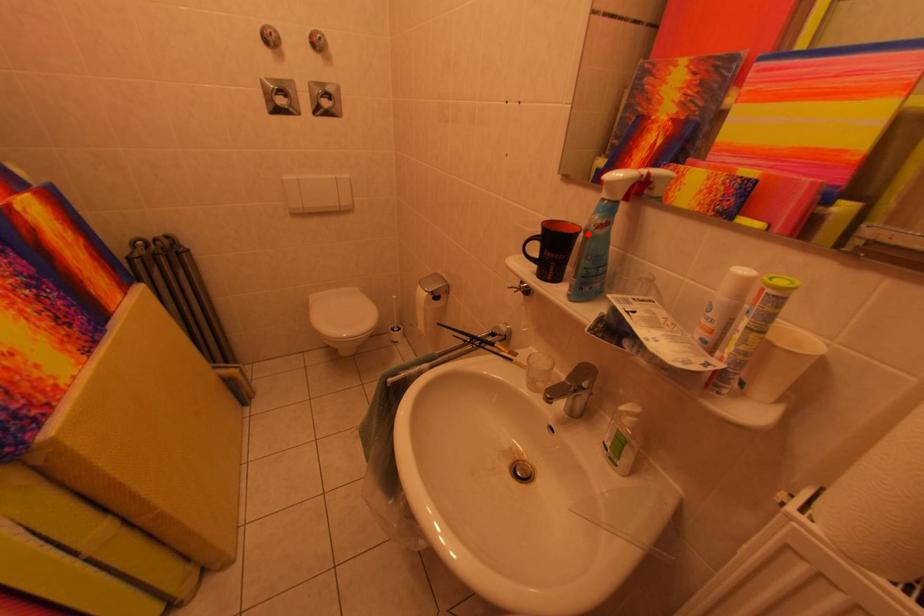
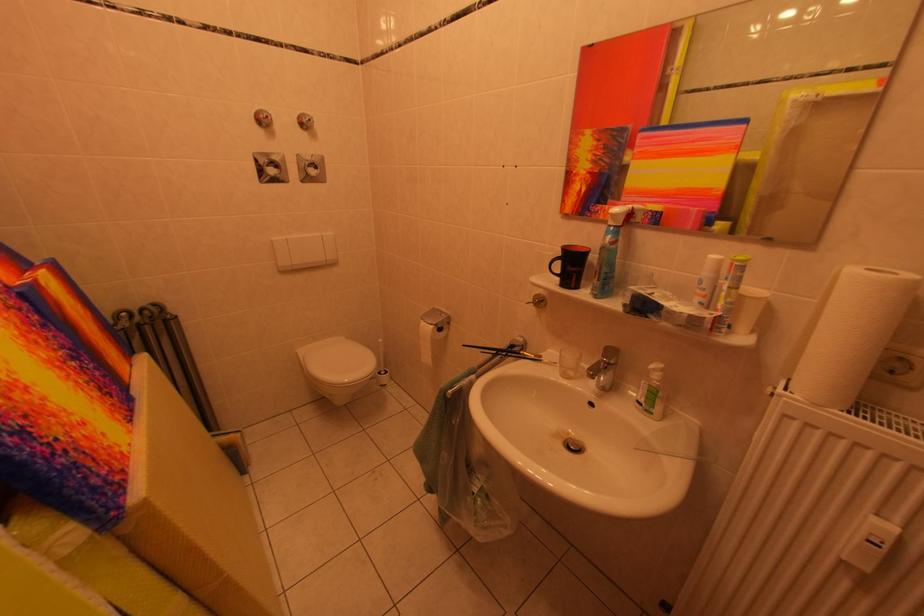
Find the pixel in the second image that matches the highlighted location in the first image.

(599, 253)